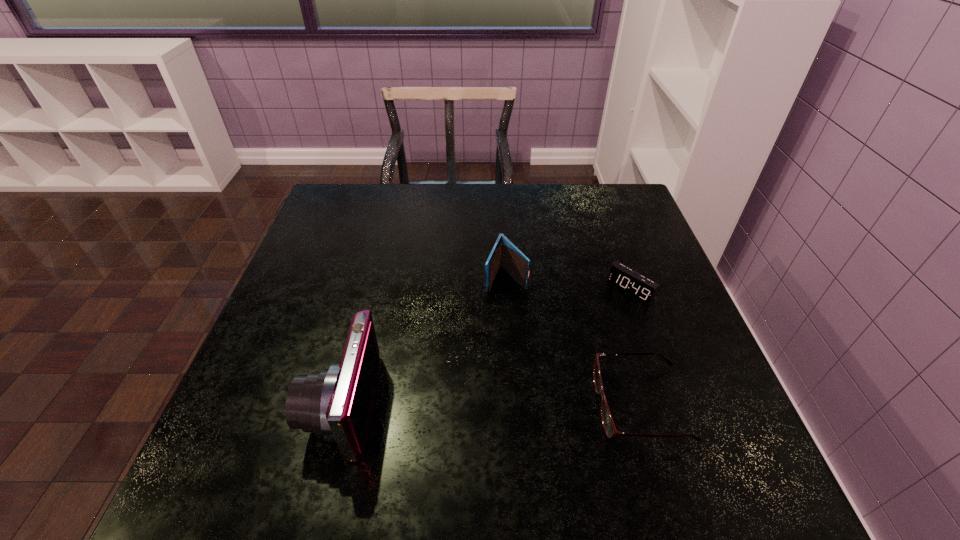
Find the location of `vacant space located 0.300m on the lenses of the spectacles`. vacant space located 0.300m on the lenses of the spectacles is located at coordinates point(442,404).

Where is `free space located 0.050m on the lenses of the spectacles`? free space located 0.050m on the lenses of the spectacles is located at coordinates (571, 404).

Identify the location of free region located on the front-facing side of the alarm clock. (590, 326).

Image resolution: width=960 pixels, height=540 pixels. I want to click on free spot located 0.220m on the front-facing side of the alarm clock, so click(560, 353).

The height and width of the screenshot is (540, 960). In order to click on free space located on the front-facing side of the alarm clock in this screenshot , I will do `click(547, 364)`.

Find the location of a particular element. The height and width of the screenshot is (540, 960). blank area located 0.060m on the exterior surface of the wallet is located at coordinates (492, 310).

At what (x,y) coordinates should I click in order to perform the action: click on vacant space located on the exterior surface of the wallet. Please return your answer as a coordinate pair (x, y). The width and height of the screenshot is (960, 540). Looking at the image, I should click on (488, 320).

The height and width of the screenshot is (540, 960). Identify the location of vacant space situated on the exterior surface of the wallet. (433, 442).

You are a GUI agent. You are given a task and a screenshot of the screen. Output one action in this format:
    pyautogui.click(x=<x>, y=<y>)
    Task: Click on the camera that is positioned at the near edge
    Image resolution: width=960 pixels, height=540 pixels.
    Given the screenshot: What is the action you would take?
    pyautogui.click(x=335, y=403)

I want to click on spectacles present at the near edge, so [x=607, y=420].